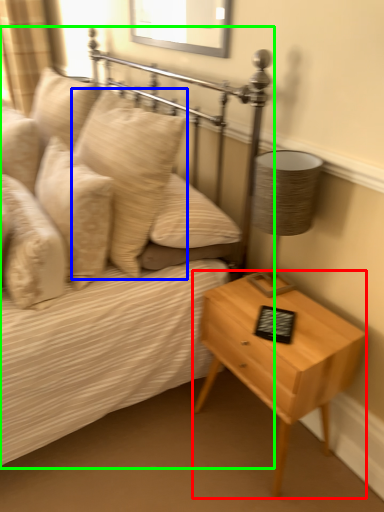
Question: Which object is positioned farthest from nightstand (highlighted by a red box)? Select from pillow (highlighted by a blue box) and bed (highlighted by a green box).

Choices:
 (A) pillow
 (B) bed

Answer: (A)